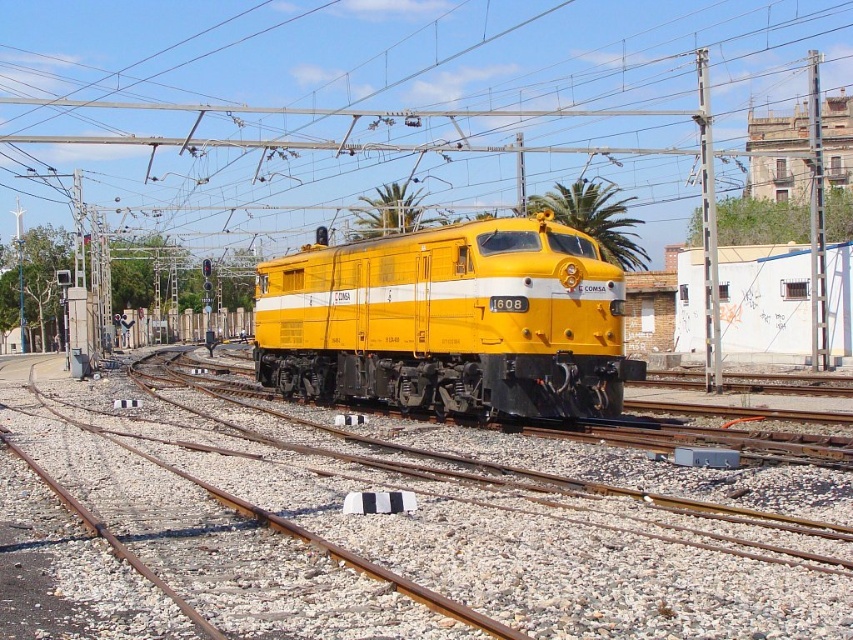
Question: Is yellow metal track at center further to the viewer compared to yellow matte locomotive at center?

Choices:
 (A) yes
 (B) no

Answer: (B)

Question: Does metallic wire at center have a lesser width compared to yellow matte locomotive at center?

Choices:
 (A) no
 (B) yes

Answer: (A)

Question: Among these objects, which one is nearest to the camera?

Choices:
 (A) metallic wire at center
 (B) yellow matte locomotive at center

Answer: (B)

Question: Which object is positioned closest to the metallic wire at center?

Choices:
 (A) yellow metal track at center
 (B) yellow matte locomotive at center

Answer: (B)

Question: Can you confirm if metallic wire at center is positioned below yellow matte locomotive at center?

Choices:
 (A) yes
 (B) no

Answer: (B)

Question: Estimate the real-world distances between objects in this image. Which object is closer to the yellow metal track at center?

Choices:
 (A) metallic wire at center
 (B) yellow matte locomotive at center

Answer: (B)